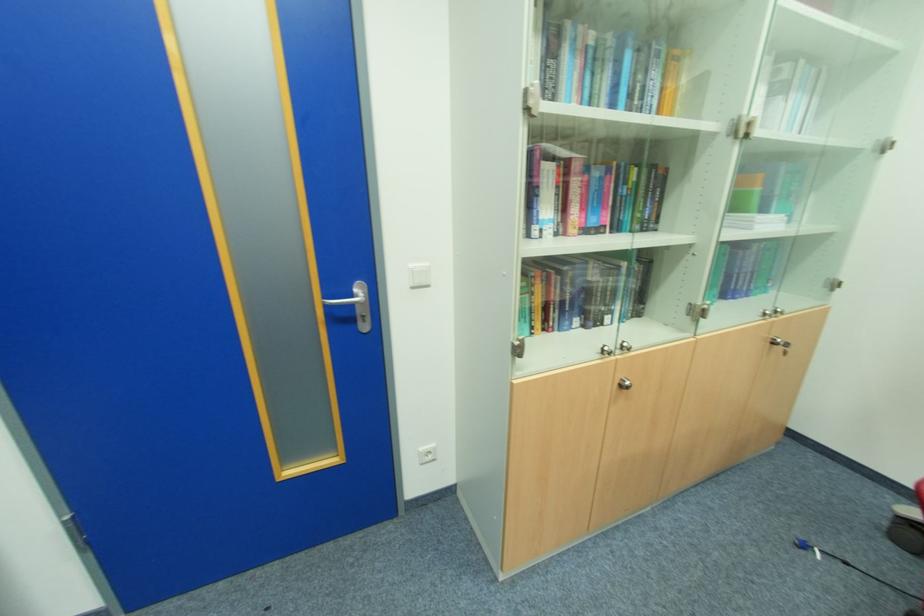
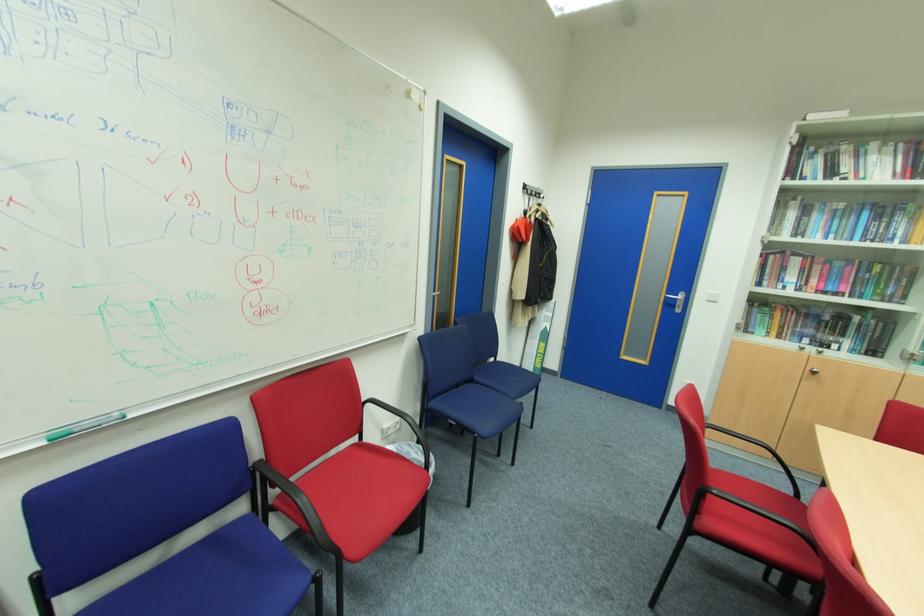
In the second image, find the point that corresponds to point 630,382 in the first image.

(820, 371)